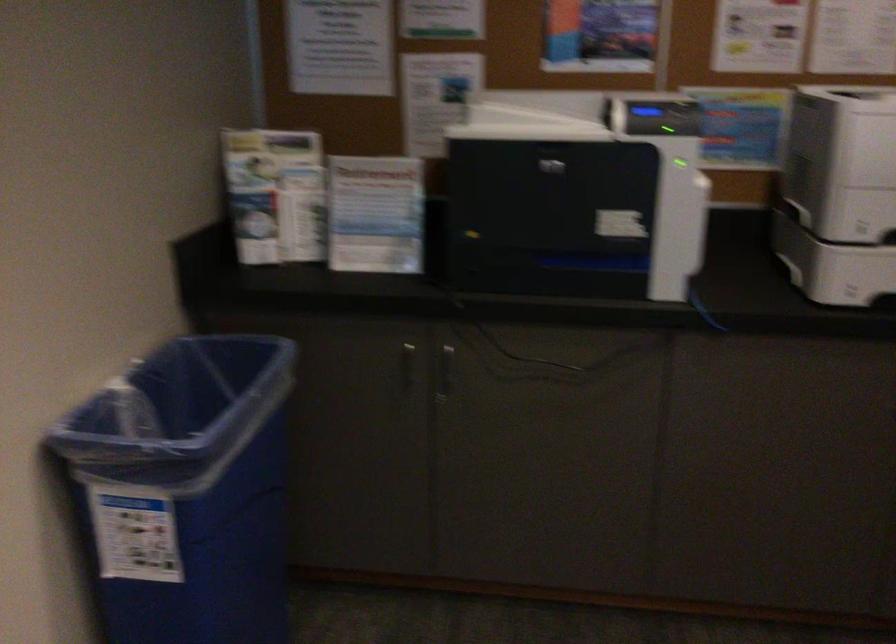
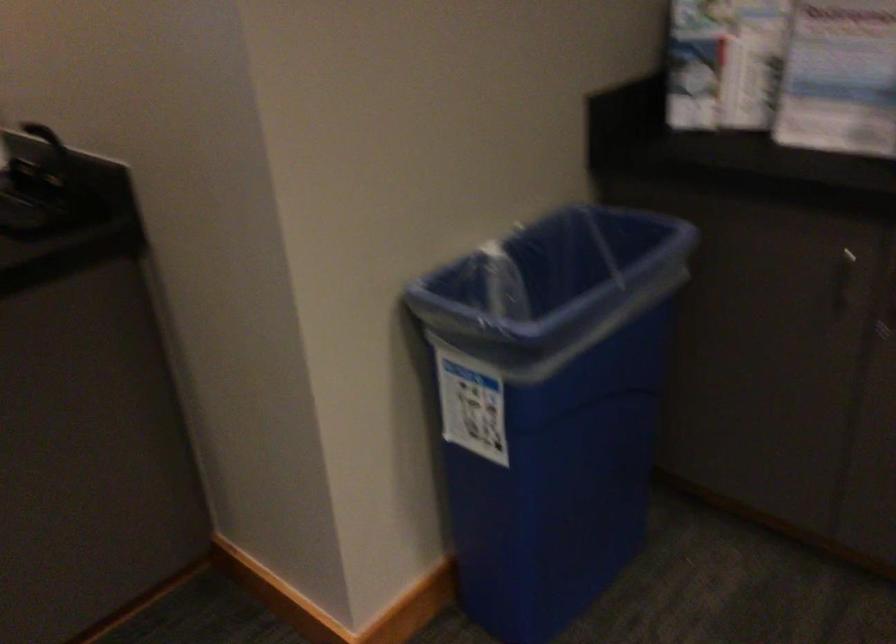
Find the pixel in the second image that matches point 141,415 in the first image.

(504, 283)